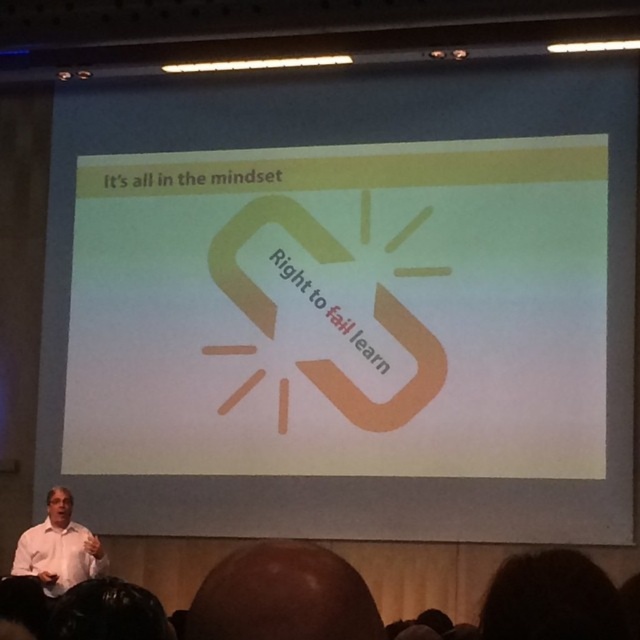
You are an attendee in the conference room. You notice the white matte projection screen at center and the smooth bald head at lower center. Which object is bigger?

The white matte projection screen at center is larger in size than smooth bald head at lower center.

You are an attendee in the conference room. You notice a smooth bald head at lower center and a white shirt at lower left. Which object is located higher in the image?

The smooth bald head at lower center is positioned over the white shirt at lower left, so it is higher up in the image.

Based on the photo, you are an attendee in a conference room and want to take a photo of the white matte projection screen at center and the white shirt at lower left. Which object is higher in the image?

The white matte projection screen at center is located above the white shirt at lower left, so it is higher in the image.